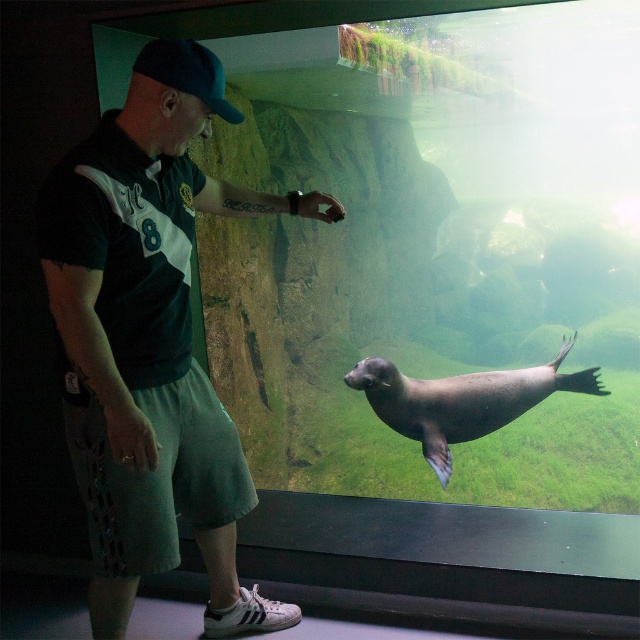
You are a tour guide explaining the aquarium to visitors. You want to highlight the size difference between the smooth gray seal at center and the dark blue fabric baseball cap at upper left. How would you describe their sizes in relation to each other?

The smooth gray seal at center is much taller than the dark blue fabric baseball cap at upper left, so the seal is significantly larger in height compared to the cap.

You are a photographer trying to capture a photo of the seal while ensuring both the dark green jersey at center and the dark blue fabric baseball cap at upper left are visible in the frame. Based on their positions, which object should you position closer to the left side of your camera viewfinder to include both in the shot?

The dark blue fabric baseball cap at upper left is positioned to the left of the dark green jersey at center, so to include both in the shot, you should position the dark blue fabric baseball cap at upper left closer to the left side of your camera viewfinder.

You are a visitor at the aquarium and notice the dark green jersey at center and the smooth gray seal at center. Which object is closer to you based on their positions?

The dark green jersey at center is positioned over the smooth gray seal at center, meaning it is closer to you.